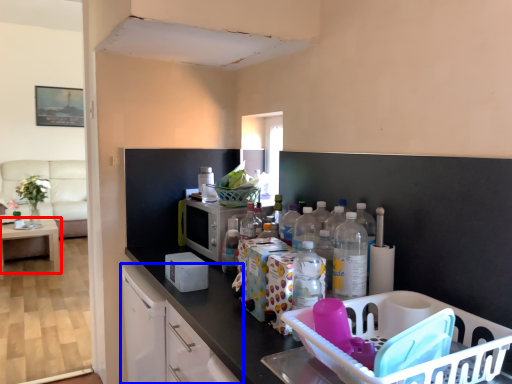
Question: Which object is further to the camera taking this photo, table (highlighted by a red box) or cabinetry (highlighted by a blue box)?

Choices:
 (A) table
 (B) cabinetry

Answer: (A)